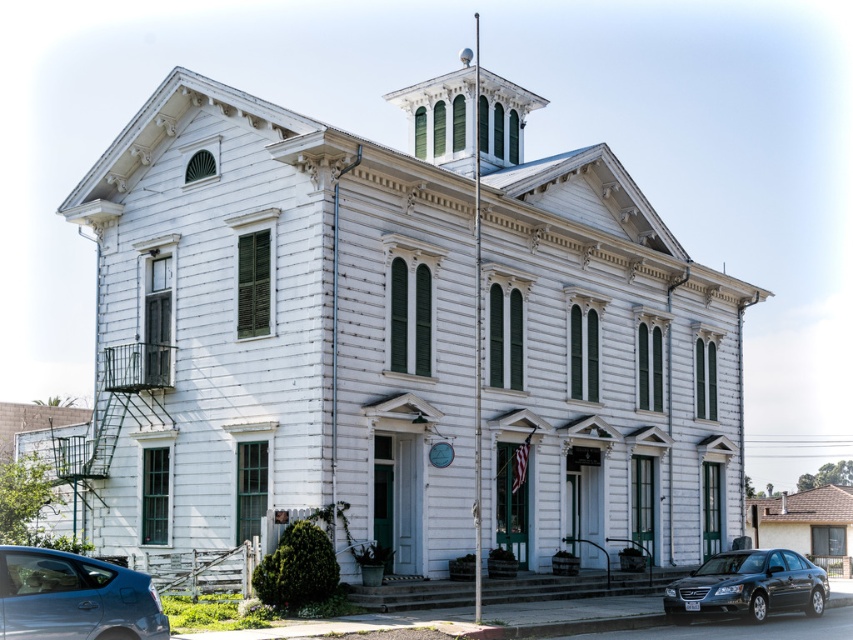
Between metallic blue sedan at lower left and shiny black sedan at lower right, which one appears on the right side from the viewer's perspective?

shiny black sedan at lower right

Does metallic blue sedan at lower left lie behind shiny black sedan at lower right?

No, metallic blue sedan at lower left is closer to the viewer.

Between point (64, 636) and point (785, 589), which one is positioned in front?

Positioned in front is point (64, 636).

Where is `metallic blue sedan at lower left`? This screenshot has width=853, height=640. metallic blue sedan at lower left is located at coordinates [x=74, y=596].